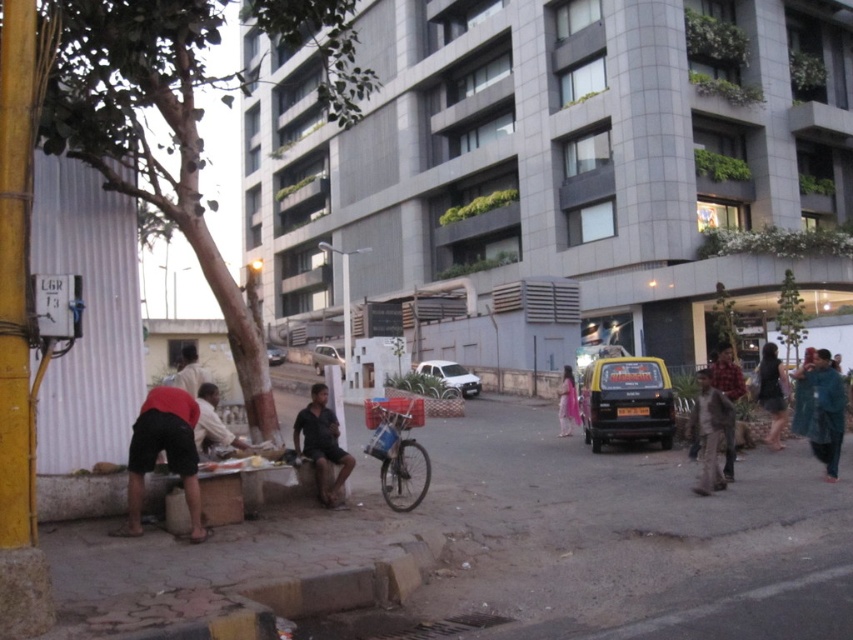
Who is positioned more to the right, green bark tree at left or blue fabric at right?

blue fabric at right is more to the right.

Who is more distant from viewer, (183, 106) or (831, 433)?

The point (831, 433) is more distant.

Describe the element at coordinates (154, 138) in the screenshot. I see `green bark tree at left` at that location.

At what (x,y) coordinates should I click in order to perform the action: click on green bark tree at left. Please return your answer as a coordinate pair (x, y). Looking at the image, I should click on (154, 138).

Find the location of `green bark tree at left`. green bark tree at left is located at coordinates (154, 138).

Can you confirm if green bark tree at left is positioned below green leafy tree at center?

Actually, green bark tree at left is above green leafy tree at center.

Describe the element at coordinates (154, 138) in the screenshot. I see `green bark tree at left` at that location.

I want to click on green bark tree at left, so click(154, 138).

Is dark blue shirt at center thinner than metallic silver car at center?

In fact, dark blue shirt at center might be wider than metallic silver car at center.

What do you see at coordinates (322, 445) in the screenshot? I see `dark blue shirt at center` at bounding box center [322, 445].

This screenshot has width=853, height=640. In order to click on dark blue shirt at center in this screenshot , I will do `click(322, 445)`.